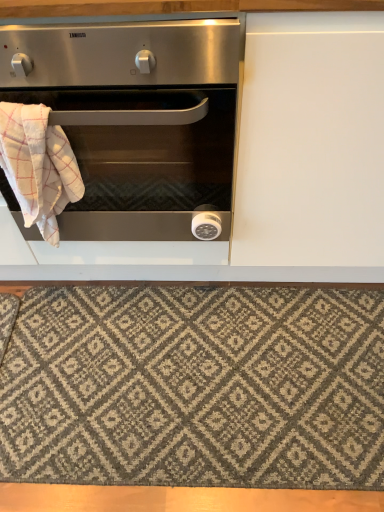
At what (x,y) coordinates should I click in order to perform the action: click on white checkered towel at left. Please return your answer as a coordinate pair (x, y). Looking at the image, I should click on (38, 166).

Locate an element on the screen. This screenshot has width=384, height=512. textured gray rug at lower center is located at coordinates (195, 387).

From a real-world perspective, who is located lower, white checkered towel at left or stainless steel oven at left?

white checkered towel at left is physically lower.

Based on the photo, between white checkered towel at left and stainless steel oven at left, which one has larger size?

Bigger between the two is stainless steel oven at left.

Can you confirm if white checkered towel at left is wider than stainless steel oven at left?

No, white checkered towel at left is not wider than stainless steel oven at left.

Considering the relative sizes of white checkered towel at left and stainless steel oven at left in the image provided, is white checkered towel at left taller than stainless steel oven at left?

No.

From the picture: Is textured gray rug at lower center shorter than white checkered towel at left?

Correct, textured gray rug at lower center is not as tall as white checkered towel at left.

Considering the positions of objects textured gray rug at lower center and white checkered towel at left in the image provided, who is in front, textured gray rug at lower center or white checkered towel at left?

white checkered towel at left.

Can you confirm if textured gray rug at lower center is wider than white checkered towel at left?

Yes, textured gray rug at lower center is wider than white checkered towel at left.

Which object is positioned more to the left, textured gray rug at lower center or white checkered towel at left?

Positioned to the left is white checkered towel at left.

Between textured gray rug at lower center and stainless steel oven at left, which one appears on the right side from the viewer's perspective?

Positioned to the right is textured gray rug at lower center.

Is textured gray rug at lower center taller or shorter than stainless steel oven at left?

Clearly, textured gray rug at lower center is shorter compared to stainless steel oven at left.

Are textured gray rug at lower center and stainless steel oven at left beside each other?

No, textured gray rug at lower center is not with stainless steel oven at left.

The width and height of the screenshot is (384, 512). In order to click on mat that is behind the stainless steel oven at left in this screenshot , I will do `click(195, 387)`.

Considering their positions, is stainless steel oven at left located in front of or behind white checkered towel at left?

stainless steel oven at left is in front of white checkered towel at left.

From the picture: In terms of size, does stainless steel oven at left appear bigger or smaller than white checkered towel at left?

Clearly, stainless steel oven at left is larger in size than white checkered towel at left.

Can we say stainless steel oven at left lies outside white checkered towel at left?

stainless steel oven at left is positioned outside white checkered towel at left.

Which of these two, stainless steel oven at left or white checkered towel at left, stands shorter?

white checkered towel at left.

Is white checkered towel at left at the left side of textured gray rug at lower center?

Indeed, white checkered towel at left is positioned on the left side of textured gray rug at lower center.

Which of these two, white checkered towel at left or textured gray rug at lower center, stands shorter?

textured gray rug at lower center is shorter.

How far apart are white checkered towel at left and textured gray rug at lower center?

white checkered towel at left is 61.46 centimeters away from textured gray rug at lower center.

Is stainless steel oven at left oriented towards textured gray rug at lower center?

No.

Considering the relative positions of stainless steel oven at left and textured gray rug at lower center in the image provided, is stainless steel oven at left to the left or to the right of textured gray rug at lower center?

Clearly, stainless steel oven at left is on the left of textured gray rug at lower center in the image.

Between stainless steel oven at left and textured gray rug at lower center, which one has larger size?

Bigger between the two is stainless steel oven at left.

Can you see stainless steel oven at left touching textured gray rug at lower center?

There is a gap between stainless steel oven at left and textured gray rug at lower center.

The width and height of the screenshot is (384, 512). Identify the location of oven that is above the white checkered towel at left (from a real-world perspective). (135, 122).

The width and height of the screenshot is (384, 512). I want to click on mat that is on the right side of white checkered towel at left, so click(x=195, y=387).

Based on their spatial positions, is textured gray rug at lower center or stainless steel oven at left further from white checkered towel at left?

Based on the image, textured gray rug at lower center appears to be further to white checkered towel at left.

When comparing their distances from stainless steel oven at left, does white checkered towel at left or textured gray rug at lower center seem further?

textured gray rug at lower center lies further to stainless steel oven at left than the other object.

When comparing their distances from textured gray rug at lower center, does white checkered towel at left or stainless steel oven at left seem further?

white checkered towel at left.

Looking at the image, which one is located closer to white checkered towel at left, stainless steel oven at left or textured gray rug at lower center?

The object closer to white checkered towel at left is stainless steel oven at left.

Based on their spatial positions, is textured gray rug at lower center or white checkered towel at left further from stainless steel oven at left?

The object further to stainless steel oven at left is textured gray rug at lower center.

Looking at this image, from the image, which object appears to be farther from textured gray rug at lower center, stainless steel oven at left or white checkered towel at left?

white checkered towel at left is positioned further to the anchor textured gray rug at lower center.

The width and height of the screenshot is (384, 512). Find the location of `blanket between stainless steel oven at left and textured gray rug at lower center from top to bottom`. blanket between stainless steel oven at left and textured gray rug at lower center from top to bottom is located at coordinates (38, 166).